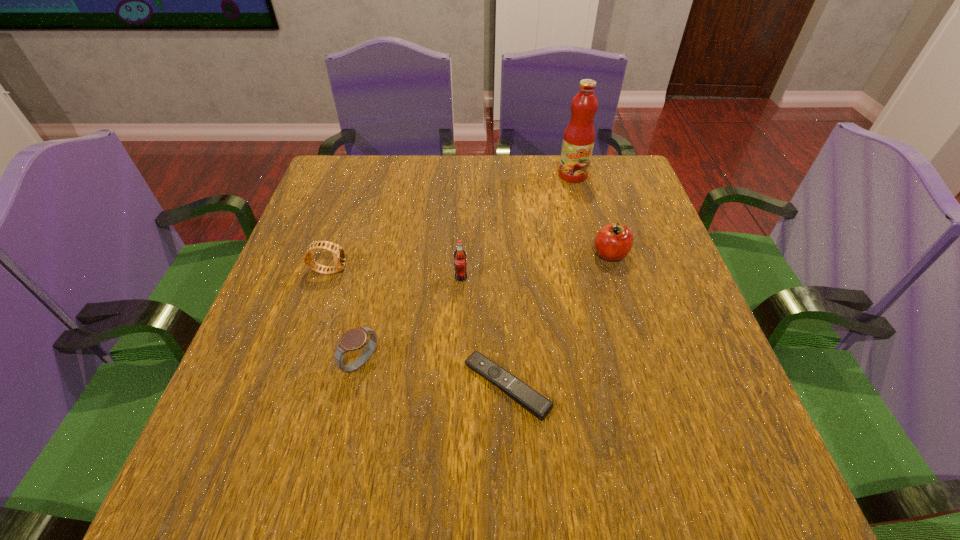
At what (x,y) coordinates should I click in order to perform the action: click on free space between the second tallest object and the right watch. Please return your answer as a coordinate pair (x, y). Image resolution: width=960 pixels, height=540 pixels. Looking at the image, I should click on (411, 321).

Locate an element on the screen. The height and width of the screenshot is (540, 960). vacant area that lies between the second object from left to right and the farthest object is located at coordinates (467, 269).

Where is `unoccupied area between the farther watch and the farthest object`? The width and height of the screenshot is (960, 540). unoccupied area between the farther watch and the farthest object is located at coordinates (451, 222).

Where is `empty space between the apple and the fruit juice`? This screenshot has height=540, width=960. empty space between the apple and the fruit juice is located at coordinates (591, 214).

Identify the location of free space between the leftmost object and the remote control. (418, 328).

Locate an element on the screen. free space between the shortest object and the tallest object is located at coordinates (540, 280).

This screenshot has width=960, height=540. In order to click on object that ranks as the closest to the second tallest object in this screenshot , I will do pyautogui.click(x=520, y=392).

Identify which object is the third closest to the right watch. Please provide its 2D coordinates. Your answer should be formatted as a tuple, i.e. [(x, y)], where the tuple contains the x and y coordinates of a point satisfying the conditions above.

[(460, 263)]

Image resolution: width=960 pixels, height=540 pixels. I want to click on vacant area that satisfies the following two spatial constraints: 1. on the face of the left watch; 2. on the back side of the shortest object, so click(290, 386).

This screenshot has height=540, width=960. Identify the location of free location that satisfies the following two spatial constraints: 1. on the face of the farther watch; 2. on the right side of the remote control. (290, 386).